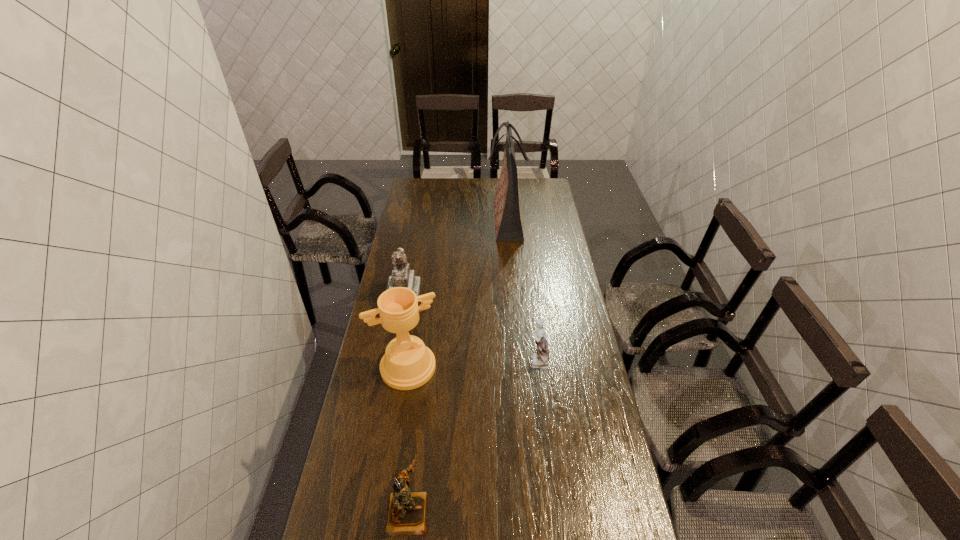
Find the location of `vacant space positioned 0.370m on the front-facing side of the second farthest object`. vacant space positioned 0.370m on the front-facing side of the second farthest object is located at coordinates (511, 296).

The height and width of the screenshot is (540, 960). I want to click on free space located on the front-facing side of the second nearest figurine, so click(x=499, y=362).

Identify the location of vacant region located 0.160m on the front-facing side of the second nearest figurine. This screenshot has height=540, width=960. (479, 362).

At what (x,y) coordinates should I click in order to perform the action: click on free space located 0.320m on the front-facing side of the second nearest figurine. Please return your answer as a coordinate pair (x, y). Looking at the image, I should click on (433, 362).

Find the location of a particular element. vacant space located on the front-facing side of the nearest figurine is located at coordinates (474, 511).

Identify the location of award present at the left edge. (407, 364).

The height and width of the screenshot is (540, 960). Identify the location of object that is positioned at the right edge. (540, 361).

In the image, there is a desktop. Where is `vacant area at the left edge`? The image size is (960, 540). vacant area at the left edge is located at coordinates (398, 399).

This screenshot has height=540, width=960. I want to click on vacant space at the right edge, so click(x=557, y=280).

Where is `vacant area at the far left corner`? This screenshot has width=960, height=540. vacant area at the far left corner is located at coordinates (416, 187).